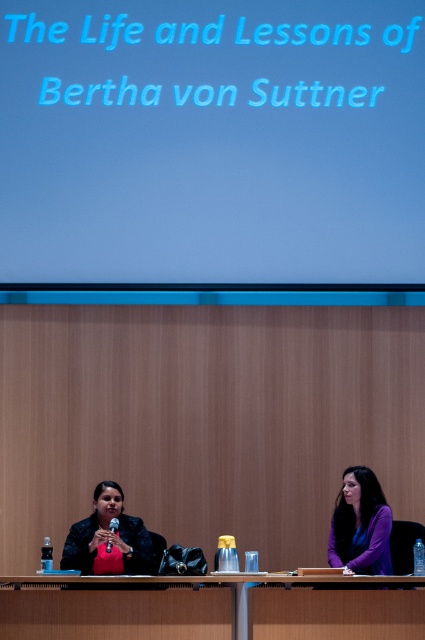
Which is more to the left, wooden table at center or purple fabric shirt at right?

wooden table at center is more to the left.

Does point (138, 602) come behind point (376, 532)?

That is False.

You are a GUI agent. You are given a task and a screenshot of the screen. Output one action in this format:
    pyautogui.click(x=<x>, y=<y>)
    Task: Click on the wooden table at center
    This screenshot has width=425, height=640.
    Given the screenshot: What is the action you would take?
    pyautogui.click(x=210, y=608)

Between point (99, 572) and point (388, 540), which one is positioned in front?

Point (99, 572) is in front.

Is matte black jacket at center wider than purple fabric shirt at right?

Indeed, matte black jacket at center has a greater width compared to purple fabric shirt at right.

Who is more distant from viewer, (99, 531) or (356, 524)?

The point (356, 524) is more distant.

The height and width of the screenshot is (640, 425). I want to click on matte black jacket at center, so click(108, 538).

Can you confirm if blue matte projection screen at upper center is positioned to the left of matte black jacket at center?

Incorrect, blue matte projection screen at upper center is not on the left side of matte black jacket at center.

In the scene shown: Does blue matte projection screen at upper center have a greater height compared to matte black jacket at center?

Indeed, blue matte projection screen at upper center has a greater height compared to matte black jacket at center.

Locate an element on the screen. The image size is (425, 640). blue matte projection screen at upper center is located at coordinates (212, 141).